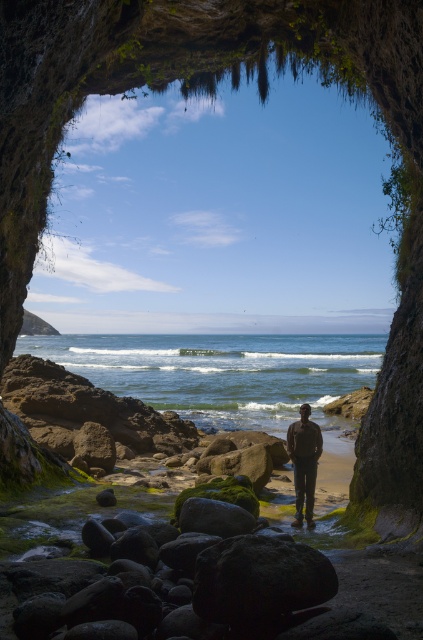
You are standing inside the cave looking out towards the beach. You see a dark matte rock at center and a dark brown leather jacket at center. Which object is closer to the cave entrance?

The dark matte rock at center is to the left of the dark brown leather jacket at center, but their positions relative to the cave entrance aren cannot be determined based on the given description.